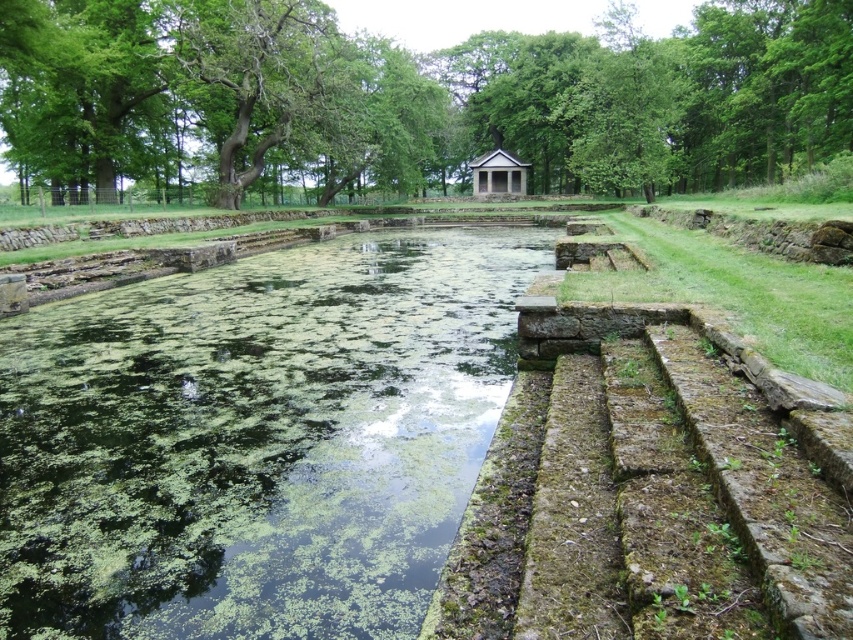
You are standing at the edge of the pool and want to walk to the point marked by point (193, 608). However, there is an obstacle at point (488, 154). Will you pass in front of or behind the obstacle?

You will pass in front of the obstacle because point (193, 608) is in front of point (488, 154).